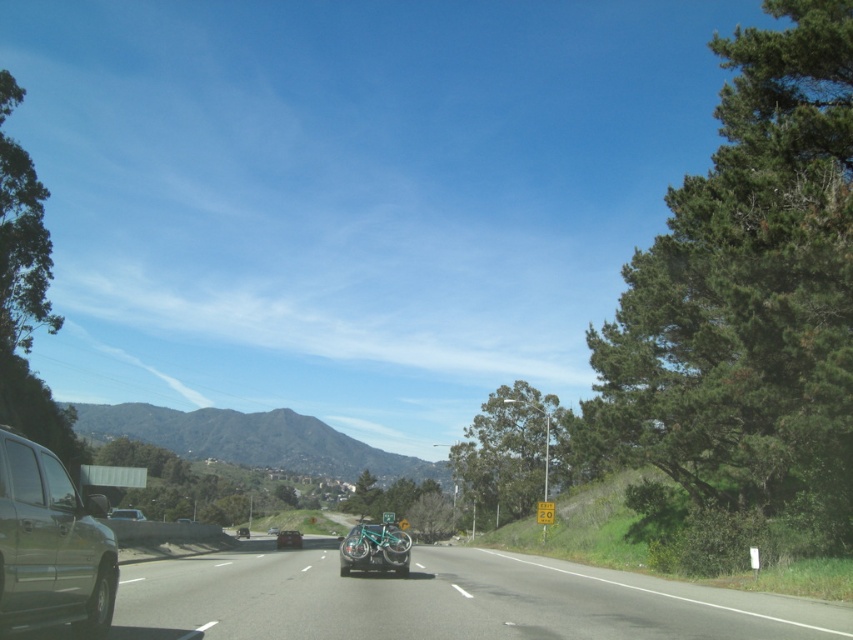
You are driving a car and see a point at coordinates (375,547) on your GPS. What object is located at that point?

The teal metallic bicycle at center is located at point (375,547).

You are a photographer standing at the center of the road, aiming to capture both points mentioned in the scene. Which point, point (0,483) or point (379,541), will appear larger in your photo?

Point (0,483) will appear larger in the photo because it is closer to the camera than point (379,541).

You are driving a truck that is 2.5 meters wide and need to pass through the space between the metallic green suv at left and the silver metallic sedan at center. Can your truck fit through the gap?

The metallic green suv at left is positioned on the right side of silver metallic sedan at center, meaning the gap between them is not specified in the objects description. However, since the suv is on the right side of the sedan, they are likely positioned side by side. Without exact measurements, it is impossible to determine if the truck can fit through the gap.